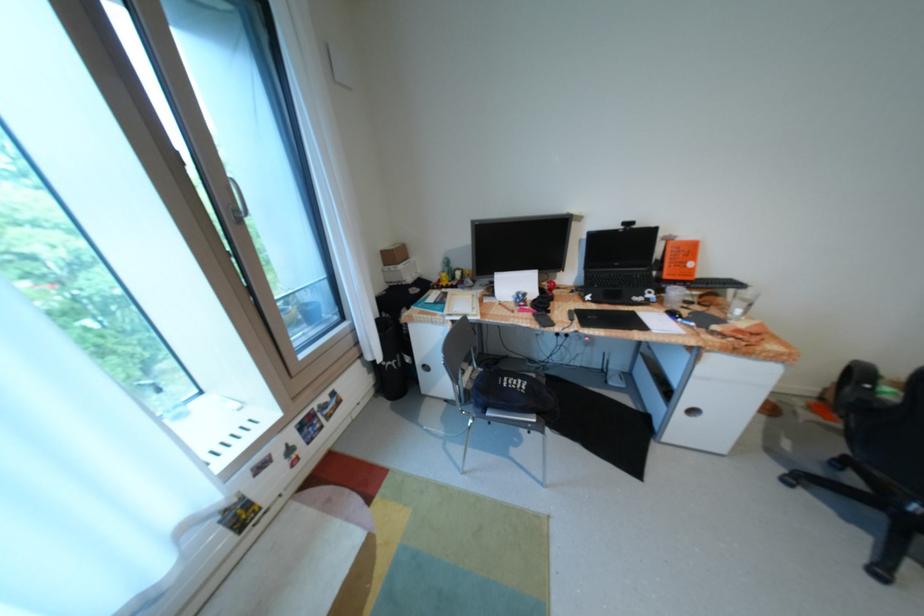
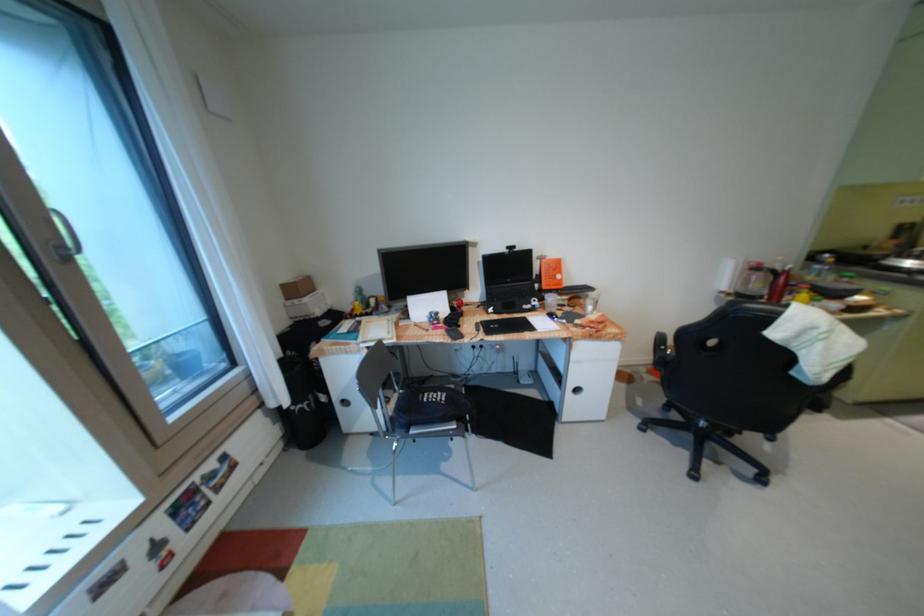
The point at (681, 267) is marked in the first image. Where is the corresponding point in the second image?

(555, 280)